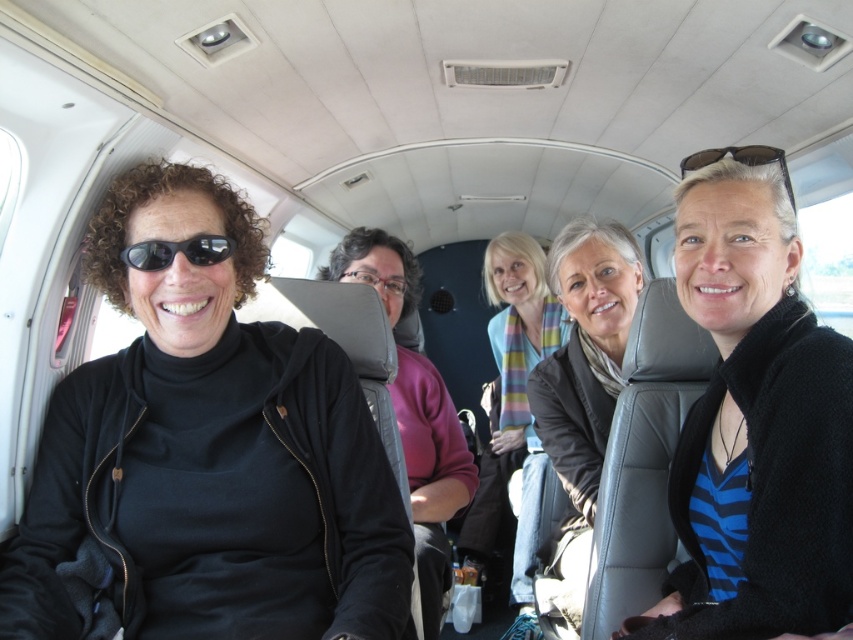
Measure the distance between point (170, 339) and camera.

Point (170, 339) is 3.55 feet away from camera.

Locate an element on the screen. This screenshot has height=640, width=853. black matte jacket at left is located at coordinates (207, 452).

How far apart are black knit sweater at center and clear plastic glasses at center?

1.17 meters

You are a GUI agent. You are given a task and a screenshot of the screen. Output one action in this format:
    pyautogui.click(x=<x>, y=<y>)
    Task: Click on the black knit sweater at center
    
    Given the screenshot: What is the action you would take?
    coord(755,420)

The height and width of the screenshot is (640, 853). What are the coordinates of `black knit sweater at center` in the screenshot? It's located at (755, 420).

The width and height of the screenshot is (853, 640). What do you see at coordinates (755, 420) in the screenshot? I see `black knit sweater at center` at bounding box center [755, 420].

Is point (808, 577) closer to viewer compared to point (399, 317)?

Yes, point (808, 577) is closer to viewer.

Is point (682, 464) farther from viewer compared to point (450, 451)?

No, it is not.

Find the location of a particular element. This screenshot has width=853, height=640. black knit sweater at center is located at coordinates (755, 420).